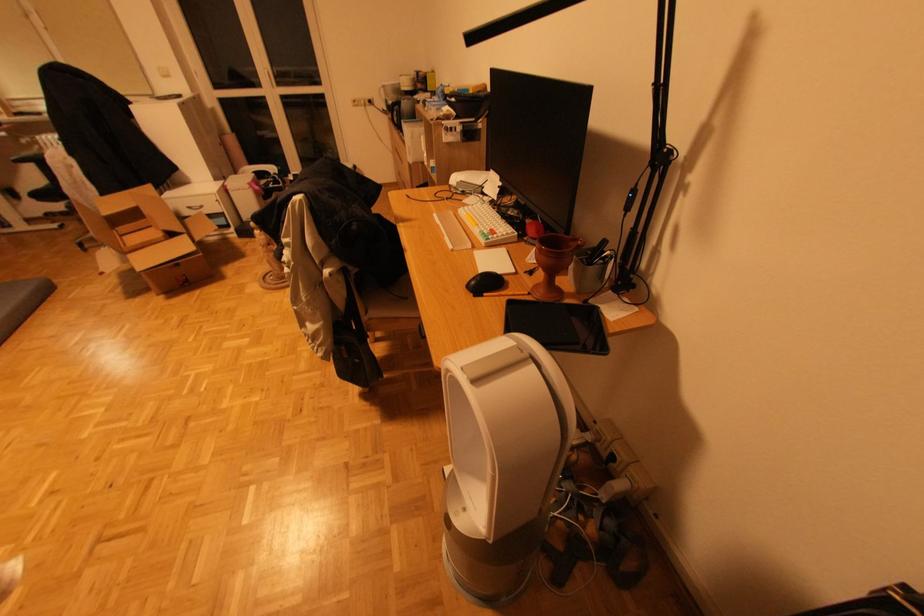
Find the location of a particular element. Image resolution: width=924 pixels, height=616 pixels. chair sitting surface is located at coordinates (387, 302).